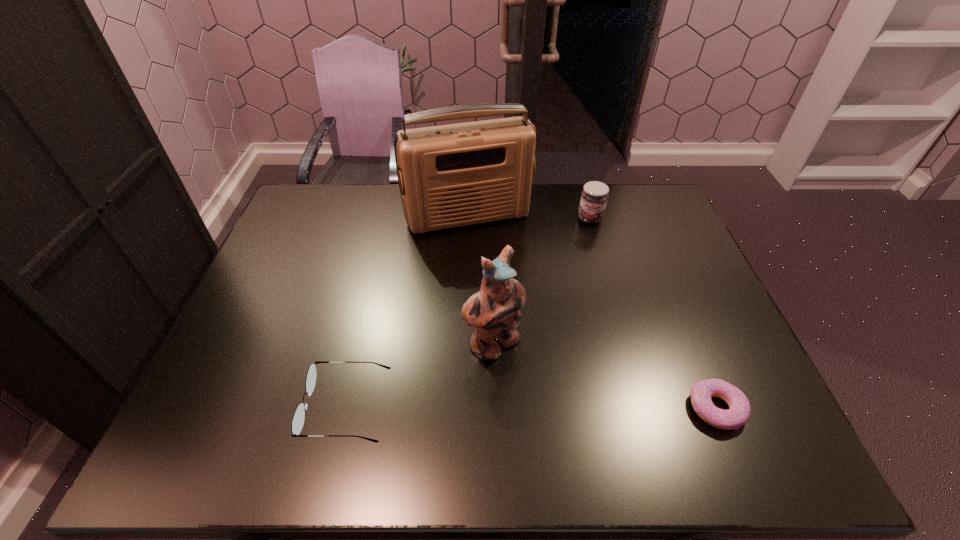
This screenshot has height=540, width=960. I want to click on free space on the desktop that is between the second shortest object and the shortest object and is positioned on the front label of the third shortest object, so click(x=572, y=408).

Where is `vacant space on the desktop that is between the second shortest object and the rightmost object and is positioned on the front-facing side of the radio receiver`? vacant space on the desktop that is between the second shortest object and the rightmost object and is positioned on the front-facing side of the radio receiver is located at coordinates (544, 408).

This screenshot has height=540, width=960. Find the location of `free space on the desktop that is between the second shortest object and the doughnut and is positioned on the front-facing side of the second tallest object`. free space on the desktop that is between the second shortest object and the doughnut and is positioned on the front-facing side of the second tallest object is located at coordinates (559, 408).